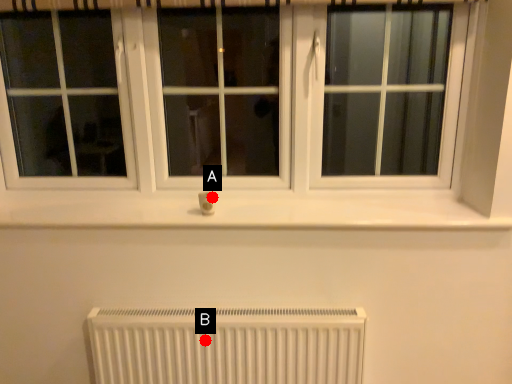
Question: Two points are circled on the image, labeled by A and B beside each circle. Among these points, which one is farthest from the camera?

Choices:
 (A) A is further
 (B) B is further

Answer: (A)